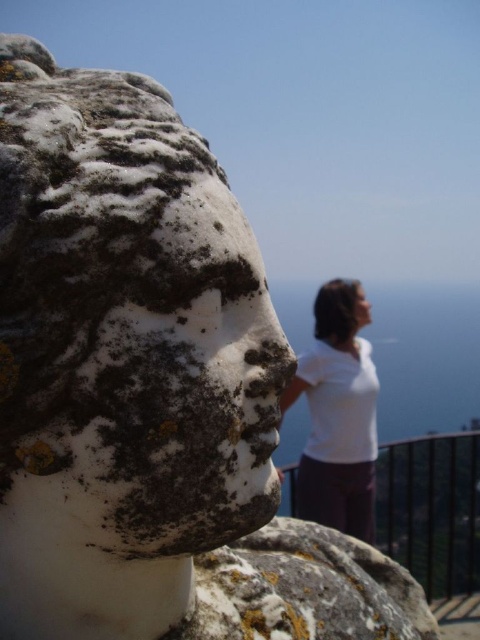
You are a photographer trying to capture the person in the image. The person is wearing a white matte shirt at upper center and has blurred hair at upper center. Which part of the person is wider in the photo?

The white matte shirt at upper center is wider than the blurred hair at upper center.

You are a photographer trying to capture the blurred hair at upper center and the white matte shirt at upper center in sharp focus. Based on the scene, can you adjust your camera settings to focus on both objects simultaneously?

The white matte shirt at upper center is closer to the viewer than the blurred hair at upper center. Since they are at different distances, it will be challenging to focus both in sharp detail simultaneously. Adjusting the aperture to a higher fstop number for greater depth of field might help, but some blurring may still occur.

You are a photographer trying to capture the blurred hair at upper center and the white matte shirt at upper center in a single shot. Given that your camera has a minimum focus distance of 5 inches, will you be able to focus on both objects simultaneously?

The white matte shirt at upper center and blurred hair at upper center are 4.80 inches apart, which is less than the camera minimum focus distance of 5 inches. Therefore, the camera can focus on both objects simultaneously.